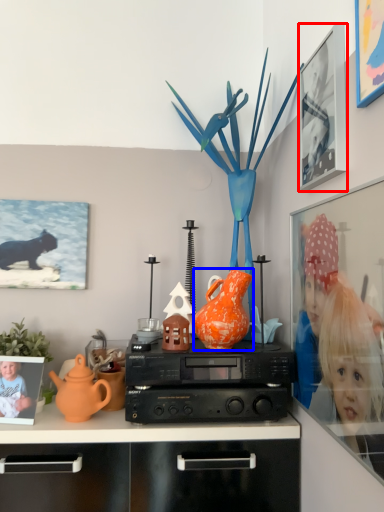
Question: Which object appears farthest to the camera in this image, picture frame (highlighted by a red box) or vase (highlighted by a blue box)?

Choices:
 (A) picture frame
 (B) vase

Answer: (B)